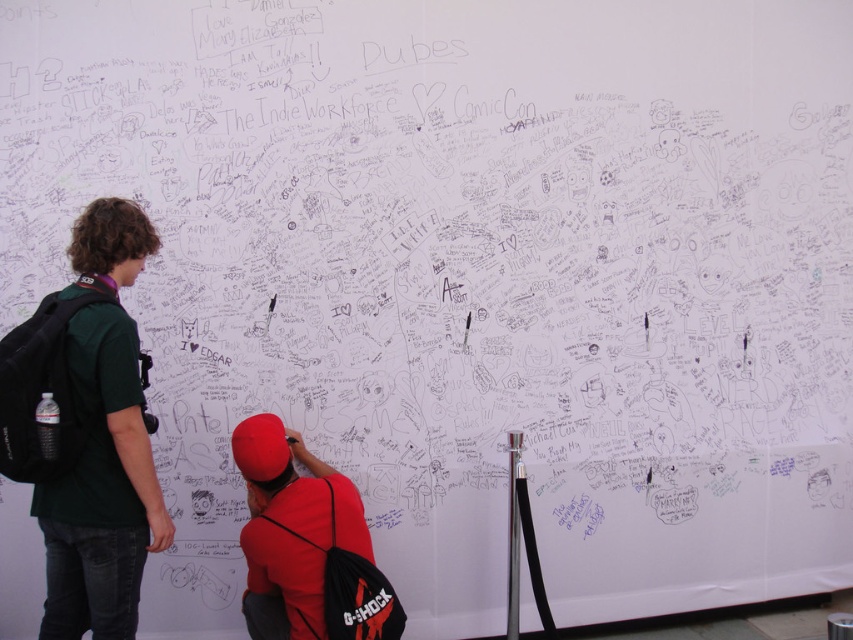
You are standing in front of the white wall covered in messages and see the green matte shirt at left. Based on its position coordinates, can you determine if it is closer to the bottom or the top of the wall?

The green matte shirt at left is located at point (102, 488), which means it is closer to the bottom of the wall since the y coordinate is lower.

You are a photographer trying to capture both the green matte shirt at left and the red fabric cap at center in a single frame. Given that your camera has a focal length of 50mm and a sensor size of 24x36mm, what is the minimum distance you need to stand from the wall to ensure both objects are fully visible in the frame?

The minimum distance required is approximately 16.80 inches divided by the sensor size ratio. However, since the sensor size and focal length are fixed, the distance must be such that the 16.80 inches fits within the 24mm width. Using the formula distance d, d > 16.80 inches divided by 24mm. Converting units, 16.80 inches is approximately 426.72mm. Thus, d > 426.72mm divided by 24mm, so d > 17.78mm. Practically, standing about 18cm away would suffice.